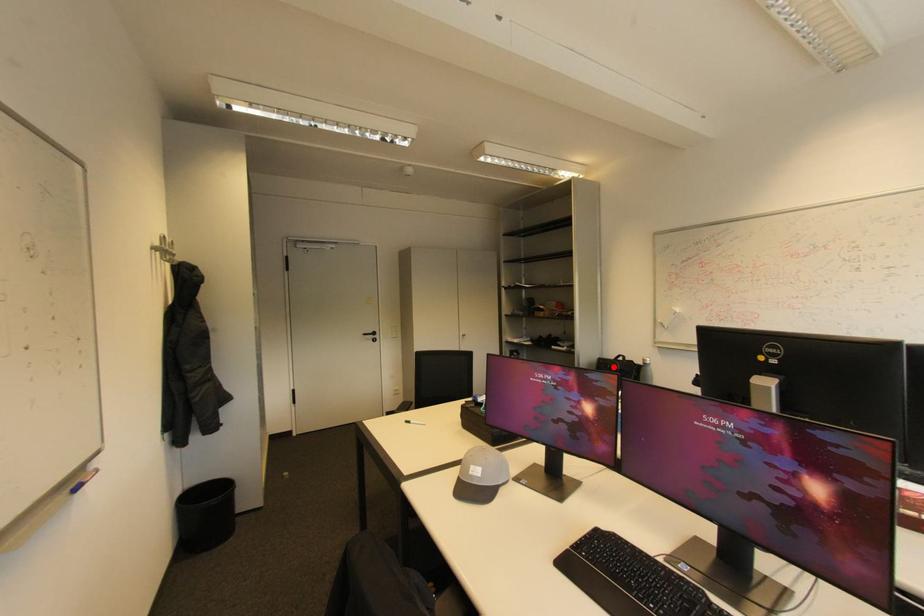
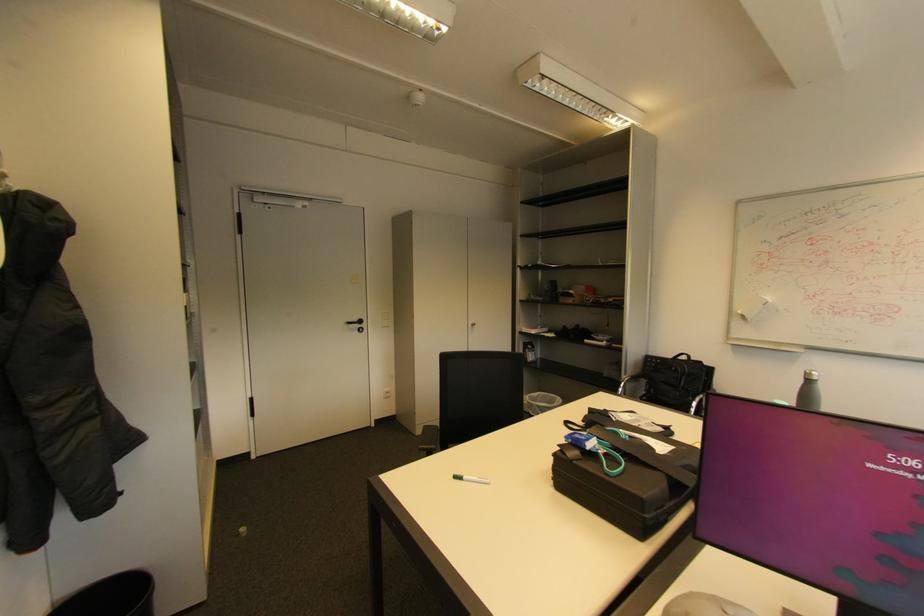
Locate, in the second image, the point that corresponds to the highlighted location in the first image.

(678, 369)